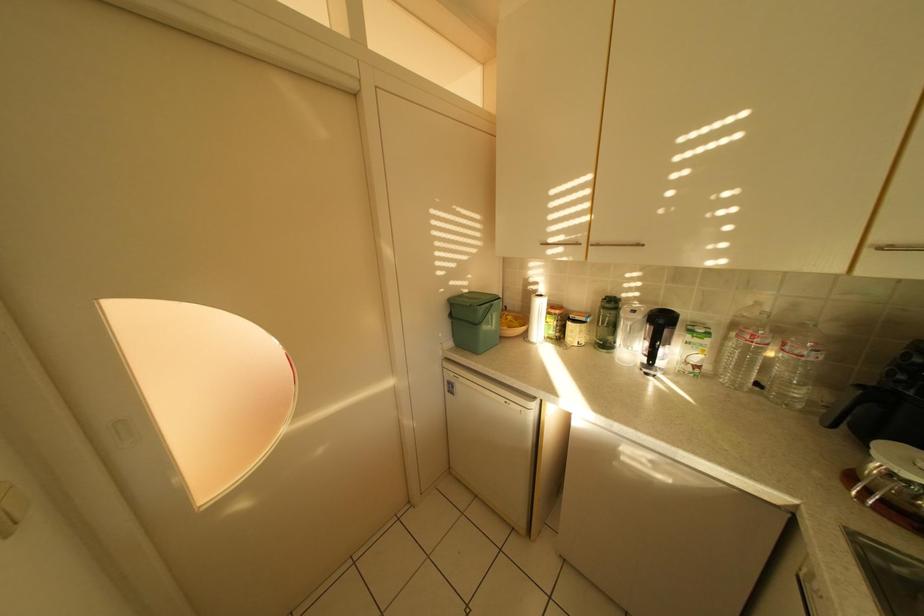
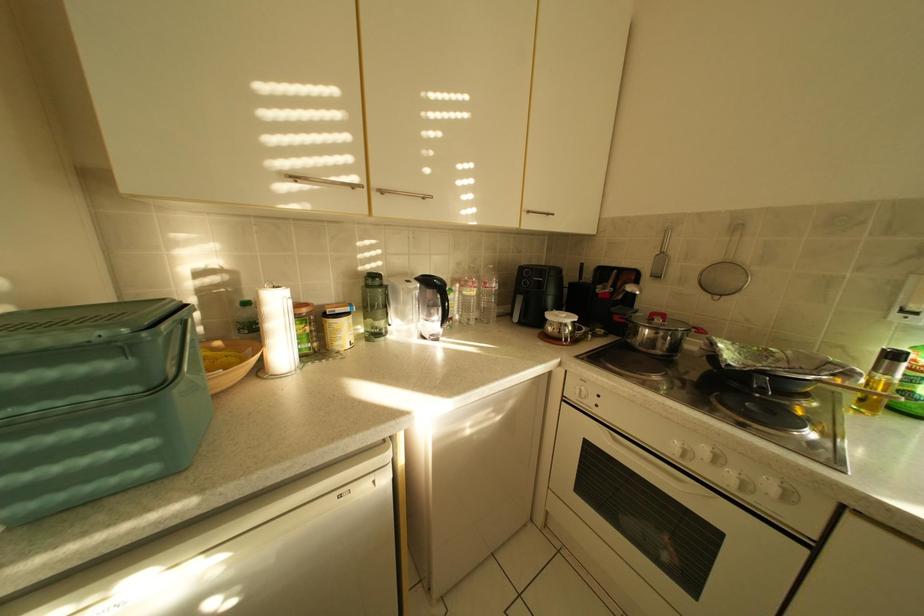
Question: The camera is either moving clockwise (left) or counter-clockwise (right) around the object. The first image is from the beginning of the video and the second image is from the end. Is the camera moving left or right when shooting the video?

Choices:
 (A) Left
 (B) Right

Answer: (A)